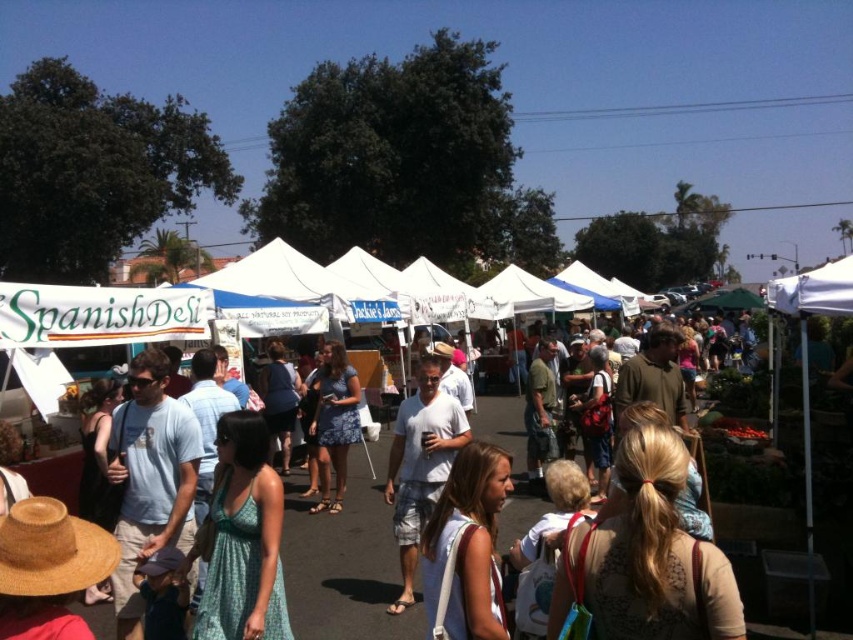
What do you see at coordinates (421, 465) in the screenshot? I see `white cotton t-shirt at center` at bounding box center [421, 465].

Can you confirm if white cotton t-shirt at center is thinner than matte blue dress at center?

No, white cotton t-shirt at center is not thinner than matte blue dress at center.

Is point (393, 433) positioned in front of point (329, 474)?

No, (393, 433) is behind (329, 474).

The width and height of the screenshot is (853, 640). What are the coordinates of `white cotton t-shirt at center` in the screenshot? It's located at (421, 465).

Is white fabric spanish deli at center further to camera compared to matte blue dress at center?

That is False.

Describe the element at coordinates (345, 561) in the screenshot. I see `white fabric spanish deli at center` at that location.

You are a GUI agent. You are given a task and a screenshot of the screen. Output one action in this format:
    pyautogui.click(x=<x>, y=<y>)
    Task: Click on the white fabric spanish deli at center
    The image size is (853, 640).
    Given the screenshot: What is the action you would take?
    pyautogui.click(x=345, y=561)

In the scene shown: Who is taller, white fabric spanish deli at center or white cotton t-shirt at center?

Standing taller between the two is white cotton t-shirt at center.

From the picture: Can you confirm if white fabric spanish deli at center is positioned to the right of white cotton t-shirt at center?

Incorrect, white fabric spanish deli at center is not on the right side of white cotton t-shirt at center.

Where is `white fabric spanish deli at center`? Image resolution: width=853 pixels, height=640 pixels. white fabric spanish deli at center is located at coordinates (345, 561).

Locate an element on the screen. This screenshot has width=853, height=640. white fabric spanish deli at center is located at coordinates (345, 561).